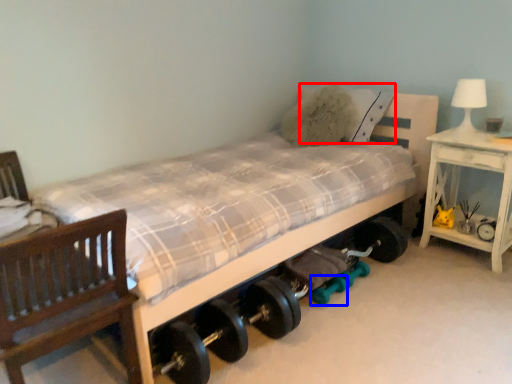
Question: Which object appears closest to the camera in this image, pillow (highlighted by a red box) or dumbbell (highlighted by a blue box)?

Choices:
 (A) pillow
 (B) dumbbell

Answer: (B)